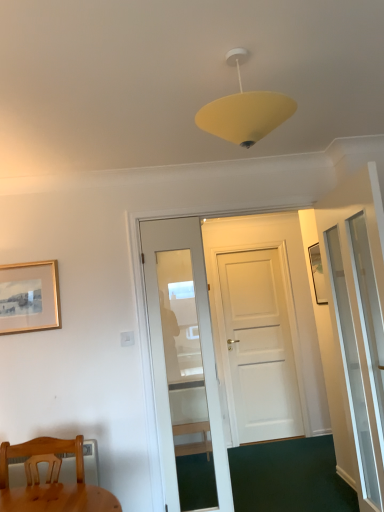
Question: From a real-world perspective, is transparent glass screen door at right positioned under gold metallic picture frame at upper left based on gravity?

Choices:
 (A) yes
 (B) no

Answer: (A)

Question: Can gold metallic picture frame at upper left be found inside transparent glass screen door at right?

Choices:
 (A) no
 (B) yes

Answer: (A)

Question: From the image's perspective, is transparent glass screen door at right beneath gold metallic picture frame at upper left?

Choices:
 (A) yes
 (B) no

Answer: (A)

Question: Is transparent glass screen door at right closer to camera compared to gold metallic picture frame at upper left?

Choices:
 (A) yes
 (B) no

Answer: (A)

Question: From the image's perspective, is transparent glass screen door at right on top of gold metallic picture frame at upper left?

Choices:
 (A) yes
 (B) no

Answer: (B)

Question: Considering the positions of point (347, 338) and point (18, 312), is point (347, 338) closer or farther from the camera than point (18, 312)?

Choices:
 (A) farther
 (B) closer

Answer: (B)

Question: Is transparent glass screen door at right spatially inside gold metallic picture frame at upper left, or outside of it?

Choices:
 (A) inside
 (B) outside

Answer: (B)

Question: Considering their positions, is transparent glass screen door at right located in front of or behind gold metallic picture frame at upper left?

Choices:
 (A) behind
 (B) front

Answer: (B)

Question: Is transparent glass screen door at right wider or thinner than gold metallic picture frame at upper left?

Choices:
 (A) wide
 (B) thin

Answer: (A)

Question: Is wooden chair at lower left inside or outside of gold metallic picture frame at upper left?

Choices:
 (A) outside
 (B) inside

Answer: (A)

Question: Visually, is wooden chair at lower left positioned to the left or to the right of gold metallic picture frame at upper left?

Choices:
 (A) right
 (B) left

Answer: (A)

Question: Does point (76, 462) appear closer or farther from the camera than point (19, 309)?

Choices:
 (A) farther
 (B) closer

Answer: (B)

Question: Is wooden chair at lower left wider or thinner than gold metallic picture frame at upper left?

Choices:
 (A) thin
 (B) wide

Answer: (B)

Question: Considering the positions of transparent glass screen door at right and wooden chair at lower left in the image, is transparent glass screen door at right wider or thinner than wooden chair at lower left?

Choices:
 (A) thin
 (B) wide

Answer: (A)

Question: Considering the positions of transparent glass screen door at right and wooden chair at lower left in the image, is transparent glass screen door at right taller or shorter than wooden chair at lower left?

Choices:
 (A) tall
 (B) short

Answer: (A)